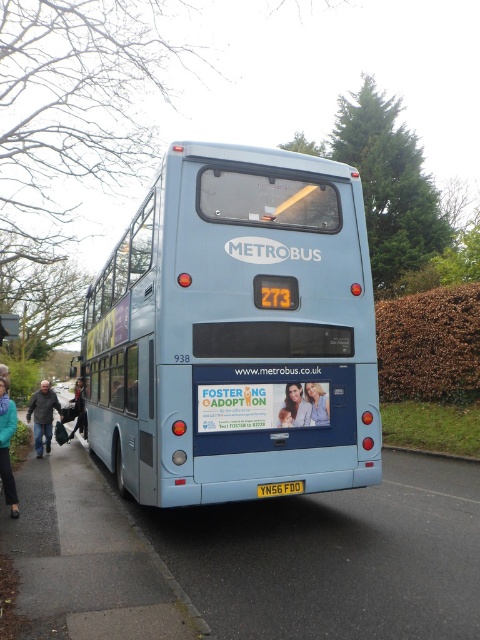
You are standing on the sidewalk and looking at the gray asphalt pavement at lower left and the teal fabric jacket at lower left. Which object is nearer to you?

The gray asphalt pavement at lower left is closer to the viewer than the teal fabric jacket at lower left.